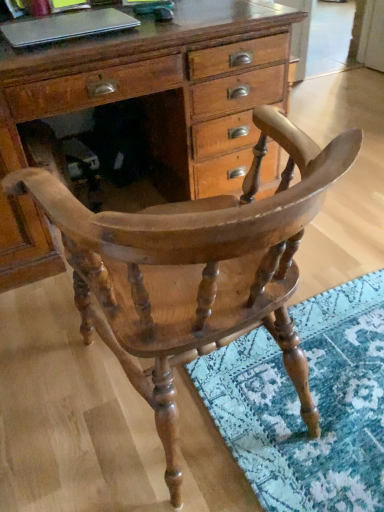
Question: Is silver metallic laptop at upper left positioned in front of wooden chair at center?

Choices:
 (A) yes
 (B) no

Answer: (B)

Question: Are silver metallic laptop at upper left and wooden chair at center far apart?

Choices:
 (A) no
 (B) yes

Answer: (A)

Question: Is silver metallic laptop at upper left not within wooden chair at center?

Choices:
 (A) yes
 (B) no

Answer: (A)

Question: From the image's perspective, is silver metallic laptop at upper left under wooden chair at center?

Choices:
 (A) no
 (B) yes

Answer: (A)

Question: Can you confirm if silver metallic laptop at upper left is thinner than wooden chair at center?

Choices:
 (A) yes
 (B) no

Answer: (A)

Question: Is point (152, 392) closer or farther from the camera than point (51, 14)?

Choices:
 (A) farther
 (B) closer

Answer: (B)

Question: From a real-world perspective, is wooden chair at center above or below silver metallic laptop at upper left?

Choices:
 (A) above
 (B) below

Answer: (B)

Question: Choose the correct answer: Is wooden chair at center inside silver metallic laptop at upper left or outside it?

Choices:
 (A) outside
 (B) inside

Answer: (A)

Question: Considering the positions of wooden chair at center and silver metallic laptop at upper left in the image, is wooden chair at center taller or shorter than silver metallic laptop at upper left?

Choices:
 (A) tall
 (B) short

Answer: (A)

Question: From the image's perspective, is silver metallic laptop at upper left located above or below wooden chair at center?

Choices:
 (A) below
 (B) above

Answer: (B)

Question: In the image, is silver metallic laptop at upper left positioned in front of or behind wooden chair at center?

Choices:
 (A) front
 (B) behind

Answer: (B)

Question: In the image, is silver metallic laptop at upper left on the left side or the right side of wooden chair at center?

Choices:
 (A) left
 (B) right

Answer: (A)

Question: Is point coord(41,37) closer or farther from the camera than point coord(336,143)?

Choices:
 (A) farther
 (B) closer

Answer: (A)

Question: Considering the positions of silver metallic laptop at upper left and wooden chest of drawers at center in the image, is silver metallic laptop at upper left wider or thinner than wooden chest of drawers at center?

Choices:
 (A) wide
 (B) thin

Answer: (B)

Question: Considering the positions of point (56, 14) and point (198, 189), is point (56, 14) closer or farther from the camera than point (198, 189)?

Choices:
 (A) farther
 (B) closer

Answer: (B)